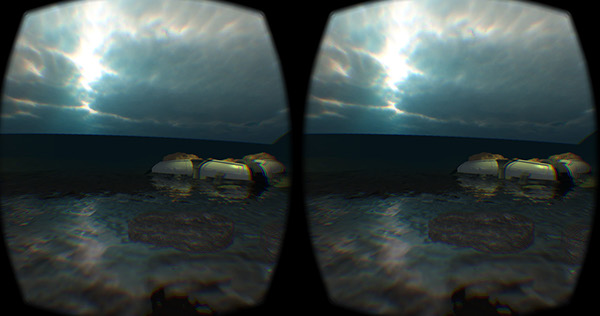
Identify the location of reflective surface. (488, 163), (538, 180), (175, 176), (229, 197).